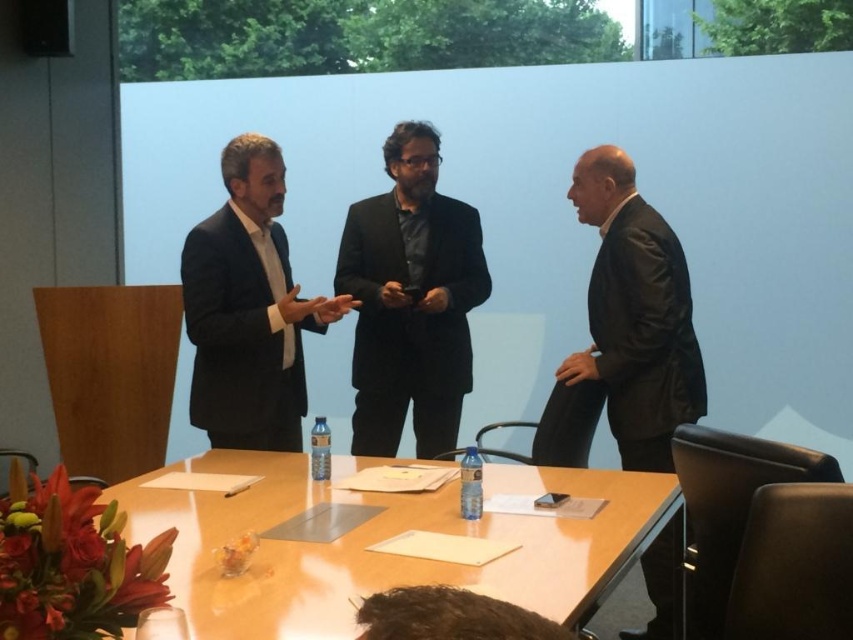
You are standing at the entrance of the conference room and want to approach the wooden table at center. In which direction should you move relative to your current position?

The wooden table at center is located at point 0.844 on the x and 0.448 on the y axis, so you should move towards the center of the room to reach it.

You are a guest entering the conference room and need to sit down at the wooden table at center. However, there is a black matte suit at center in your way. Can you walk around the suit to reach the table?

The wooden table at center is in front of the black matte suit at center, so you can walk around the suit to reach the table since it is positioned behind the table.

You are organizing a meeting in this room and need to place a large presentation screen between the wooden table at center and the black leather jacket at right. Based on their positions, will the screen fit if it requires 1 meter of space between them?

The wooden table at center is to the left of black leather jacket at right, but the exact distance between them isn not specified in the objects description. Therefore, it is impossible to determine if the screen will fit without additional information about the distance between them.